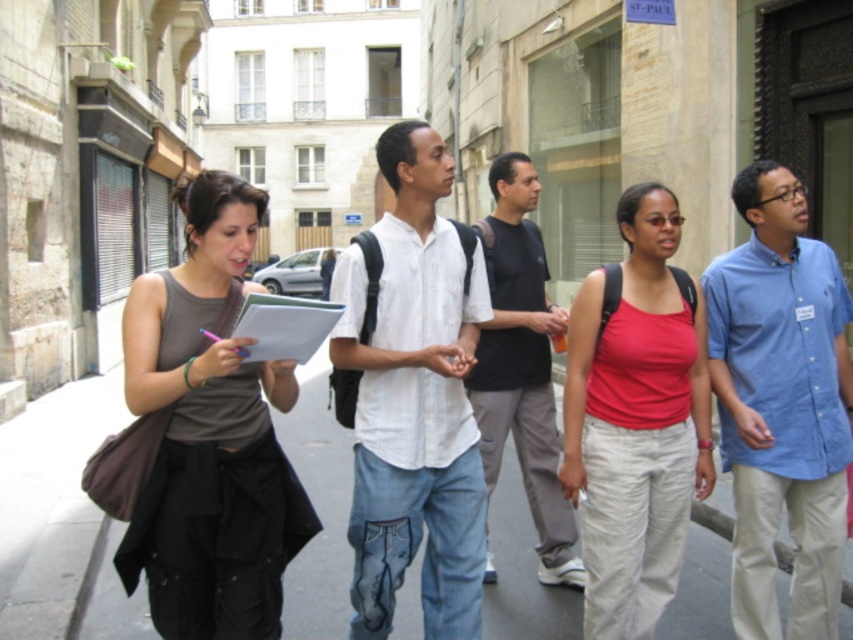
You are standing at point (767, 362) and want to walk to the woman holding a notebook and pen on the left side of the frame. Is the point (154, 586) in front of or behind you as you move towards her?

Point (154, 586) is in front of point (767, 362), so it is in front of you as you move towards the woman holding a notebook and pen on the left side of the frame.

Based on the scene description, where is the matte gray tank top at center located in the image?

The matte gray tank top at center is located at the point with coordinates 0.681 on the x axis and 0.246 on the y axis.

You are a photographer standing in front of the group and want to take a photo focusing on the matte gray tank top at center and the black cotton shirt at center. Which one will appear larger in the photo?

The matte gray tank top at center will appear larger in the photo because it is closer to the viewer than the black cotton shirt at center.